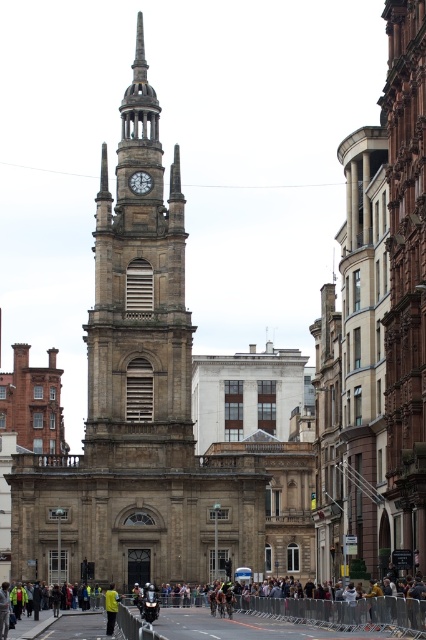
Is multicolored fabric crowd at center behind yellow fabric jacket at center?

No, multicolored fabric crowd at center is in front of yellow fabric jacket at center.

Identify the location of multicolored fabric crowd at center. (342, 612).

In the scene shown: Who is positioned more to the left, brown stone clock tower at center or yellow fabric jacket at center?

brown stone clock tower at center is more to the left.

Which is more to the right, brown stone clock tower at center or yellow fabric jacket at center?

yellow fabric jacket at center is more to the right.

Find the location of a particular element. The height and width of the screenshot is (640, 426). brown stone clock tower at center is located at coordinates (x=138, y=301).

Between yellow fabric jacket at center and white marble clock at upper center, which one appears on the right side from the viewer's perspective?

Positioned to the right is white marble clock at upper center.

In the scene shown: Measure the distance between point [108,628] and camera.

Point [108,628] is 93.72 meters from camera.

Which is behind, point (112, 611) or point (152, 188)?

The point (152, 188) is more distant.

At what (x,y) coordinates should I click in order to perform the action: click on yellow fabric jacket at center. Please return your answer as a coordinate pair (x, y). This screenshot has width=426, height=640. Looking at the image, I should click on (111, 608).